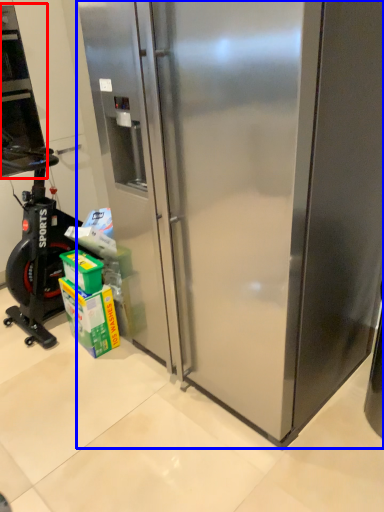
Question: Which object is closer to the camera taking this photo, home appliance (highlighted by a red box) or refrigerator (highlighted by a blue box)?

Choices:
 (A) home appliance
 (B) refrigerator

Answer: (B)